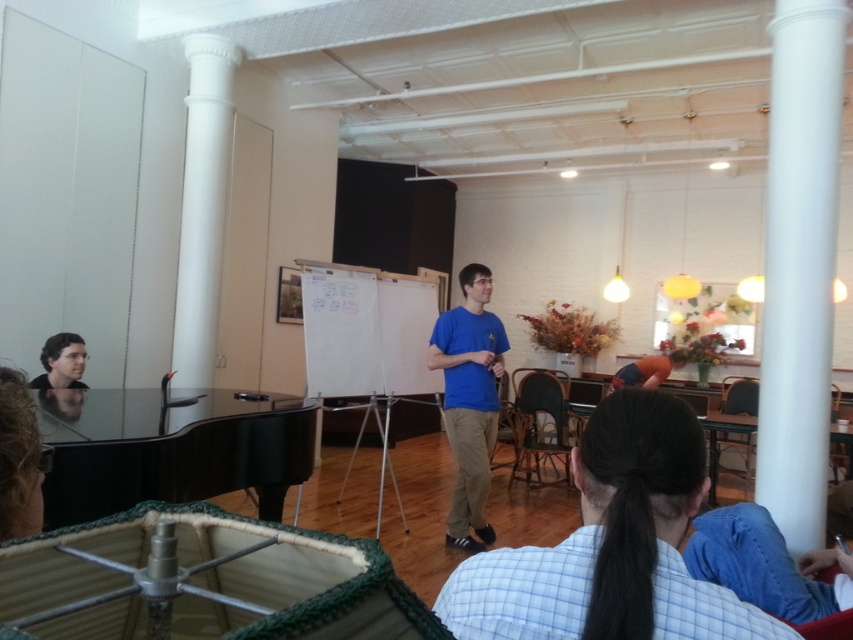
Which is above, blue cotton shirt at center or matte black hair at lower left?

matte black hair at lower left is higher up.

Is point (495, 337) closer to camera compared to point (74, 368)?

No, (495, 337) is further to viewer.

Locate an element on the screen. The height and width of the screenshot is (640, 853). blue cotton shirt at center is located at coordinates (469, 401).